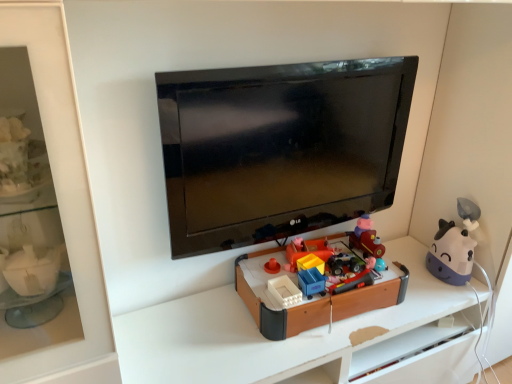
Identify the location of free space above brown plastic toy at center, which is the fifth toy from right to left (from a real-world perspective). This screenshot has height=384, width=512. (327, 269).